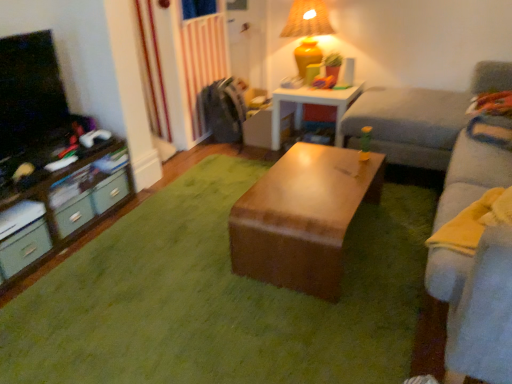
The image size is (512, 384). I want to click on free location to the right of matte gray drawer at lower left, placed as the first drawer when sorted from front to back, so click(69, 264).